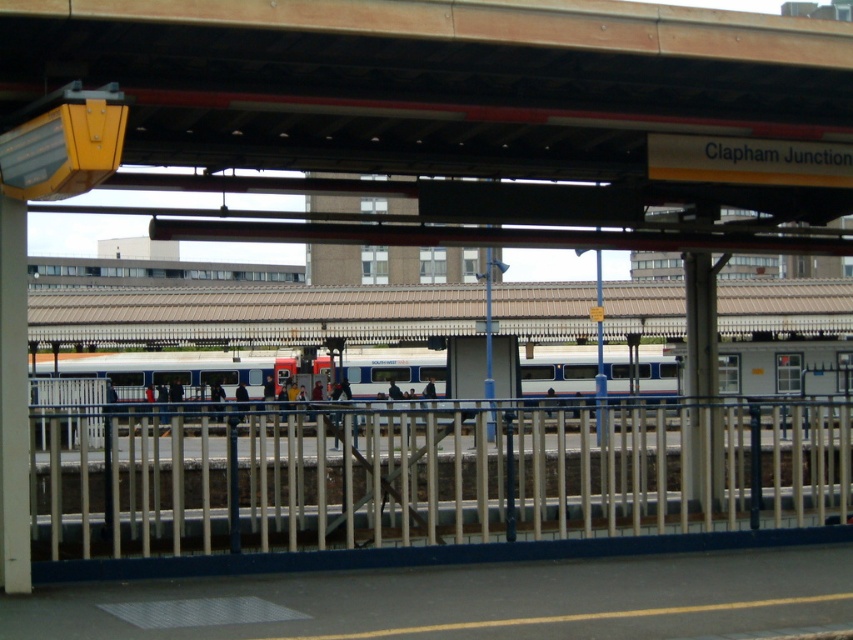
You are a maintenance worker checking the height of objects in the station. Which object has a smaller height between the wooden beam at upper center and the metallic silver rail at center?

The wooden beam at upper center has a lesser height compared to the metallic silver rail at center, so the wooden beam at upper center is smaller in height.

You are a maintenance worker at Clapham Junction railway station. You need to inspect both the wooden beam at upper center and the metallic silver rail at center. Which object should you check first if you want to start from the highest point?

You should check the wooden beam at upper center first because it is located above the metallic silver rail at center, making it the higher object.

You are standing at the Clapham Junction railway station and see two points marked on the platform. The first point is at coordinate point (759, 97) and the second is at point (200, 538). Which point is closer to your current position?

Point (200, 538) is closer to your current position because it is nearer to the camera compared to point (759, 97), which is further away.